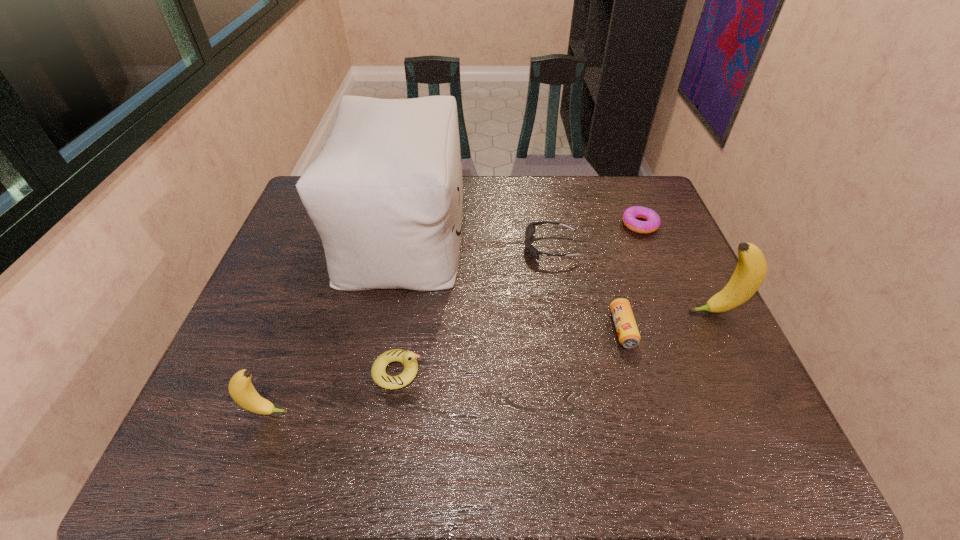
You are a GUI agent. You are given a task and a screenshot of the screen. Output one action in this format:
    pyautogui.click(x=<x>, y=<y>)
    Task: Click on the blank region between the beer can and the doughnut
    
    Given the screenshot: What is the action you would take?
    pyautogui.click(x=632, y=277)

Locate an element on the screen. vacant area that lies between the beer can and the fourth shortest object is located at coordinates (510, 350).

Where is `empty location between the tallest object and the beer can`? This screenshot has width=960, height=540. empty location between the tallest object and the beer can is located at coordinates (513, 281).

Find the location of a particular element. This screenshot has width=960, height=540. free space that is in between the right banana and the third object from right to left is located at coordinates (668, 320).

Find the location of a particular element. The image size is (960, 540). vacant area that lies between the shortest object and the farther banana is located at coordinates (677, 268).

Locate an element on the screen. This screenshot has width=960, height=540. free spot between the goggles and the beer can is located at coordinates (587, 288).

Find the location of a particular element. The width and height of the screenshot is (960, 540). object that is the fourth closest to the fourth shortest object is located at coordinates (627, 331).

At what (x,y) coordinates should I click in order to perform the action: click on the second closest object to the taller banana. Please return your answer as a coordinate pair (x, y). Image resolution: width=960 pixels, height=540 pixels. Looking at the image, I should click on (652, 223).

You are a GUI agent. You are given a task and a screenshot of the screen. Output one action in this format:
    pyautogui.click(x=<x>, y=<y>)
    Task: Click on the vacant space that satisfies the following two spatial constraints: 1. on the front side of the fifth object from left to right; 2. from the stem of the left banana
    This screenshot has height=540, width=960.
    Given the screenshot: What is the action you would take?
    pyautogui.click(x=647, y=413)

Locate an element on the screen. Image resolution: width=960 pixels, height=540 pixels. free location that satisfies the following two spatial constraints: 1. on the back side of the third object from right to left; 2. on the side of the tallest object with the smiley face is located at coordinates (595, 233).